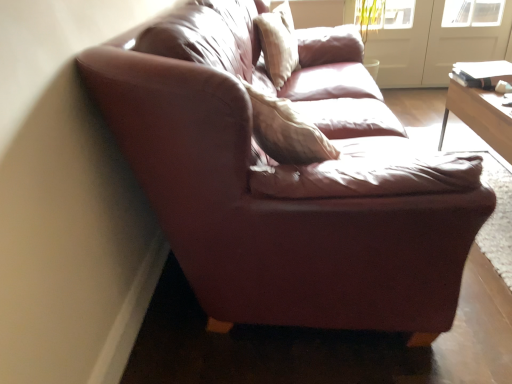
Question: Is light beige fabric pillow at upper center at the left side of white glossy screen door at upper right, the second screen door viewed from the right?

Choices:
 (A) yes
 (B) no

Answer: (A)

Question: Is the depth of light beige fabric pillow at upper center less than that of white glossy screen door at upper right, the second screen door viewed from the right?

Choices:
 (A) yes
 (B) no

Answer: (A)

Question: From a real-world perspective, is light beige fabric pillow at upper center positioned over white glossy screen door at upper right, the second screen door viewed from the right, based on gravity?

Choices:
 (A) no
 (B) yes

Answer: (B)

Question: Is light beige fabric pillow at upper center taller than white glossy screen door at upper right, arranged as the 1th screen door when viewed from the left?

Choices:
 (A) yes
 (B) no

Answer: (B)

Question: Is light beige fabric pillow at upper center facing away from white glossy screen door at upper right, the second screen door viewed from the right?

Choices:
 (A) yes
 (B) no

Answer: (B)

Question: Would you say white glossy screen door at upper right, arranged as the 1th screen door when viewed from the left, is inside or outside light beige fabric pillow at upper center?

Choices:
 (A) outside
 (B) inside

Answer: (A)

Question: Visually, is white glossy screen door at upper right, arranged as the 1th screen door when viewed from the left, positioned to the left or to the right of light beige fabric pillow at upper center?

Choices:
 (A) left
 (B) right

Answer: (B)

Question: Is white glossy screen door at upper right, arranged as the 1th screen door when viewed from the left, taller or shorter than light beige fabric pillow at upper center?

Choices:
 (A) short
 (B) tall

Answer: (B)

Question: From a real-world perspective, is white glossy screen door at upper right, arranged as the 1th screen door when viewed from the left, above or below light beige fabric pillow at upper center?

Choices:
 (A) below
 (B) above

Answer: (A)

Question: In the image, is white glossy screen door at upper right, the second screen door viewed from the right, positioned in front of or behind transparent glass screen door at upper right, which appears as the 1th screen door when viewed from the right?

Choices:
 (A) front
 (B) behind

Answer: (B)

Question: From the image's perspective, is white glossy screen door at upper right, arranged as the 1th screen door when viewed from the left, located above or below transparent glass screen door at upper right, which is the second screen door from left to right?

Choices:
 (A) below
 (B) above

Answer: (B)

Question: From a real-world perspective, is white glossy screen door at upper right, the second screen door viewed from the right, physically located above or below transparent glass screen door at upper right, which appears as the 1th screen door when viewed from the right?

Choices:
 (A) above
 (B) below

Answer: (A)

Question: Is white glossy screen door at upper right, arranged as the 1th screen door when viewed from the left, taller or shorter than transparent glass screen door at upper right, which appears as the 1th screen door when viewed from the right?

Choices:
 (A) tall
 (B) short

Answer: (A)

Question: In terms of height, does light beige fabric pillow at upper center look taller or shorter compared to transparent glass screen door at upper right, which is the second screen door from left to right?

Choices:
 (A) tall
 (B) short

Answer: (B)

Question: Is point (286, 44) closer or farther from the camera than point (458, 28)?

Choices:
 (A) farther
 (B) closer

Answer: (B)